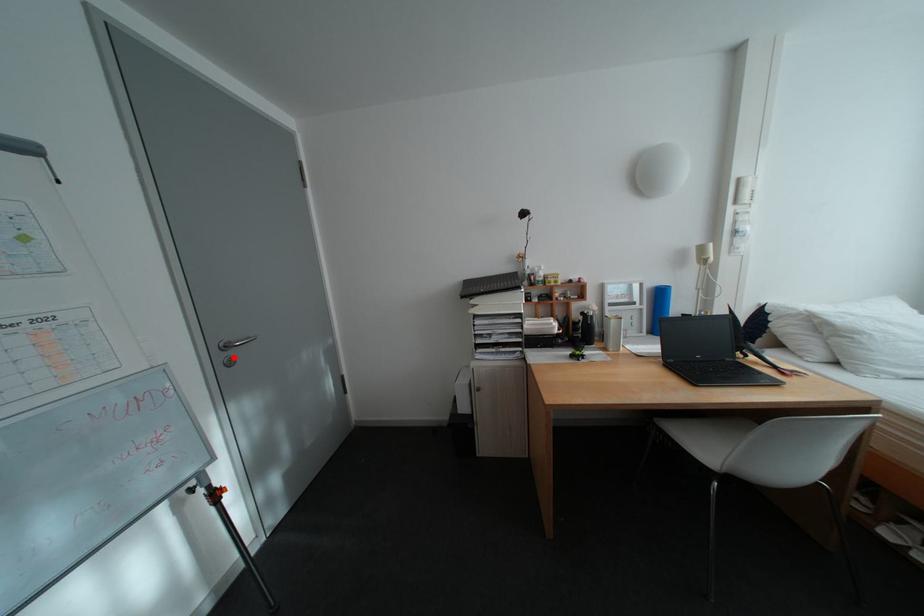
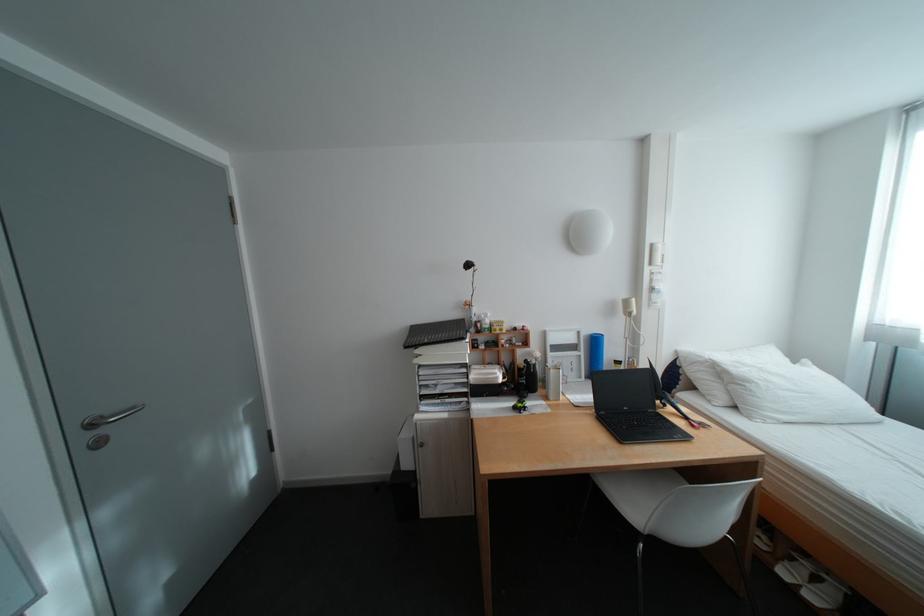
The point at the highlighted location is marked in the first image. Where is the corresponding point in the second image?

(99, 438)